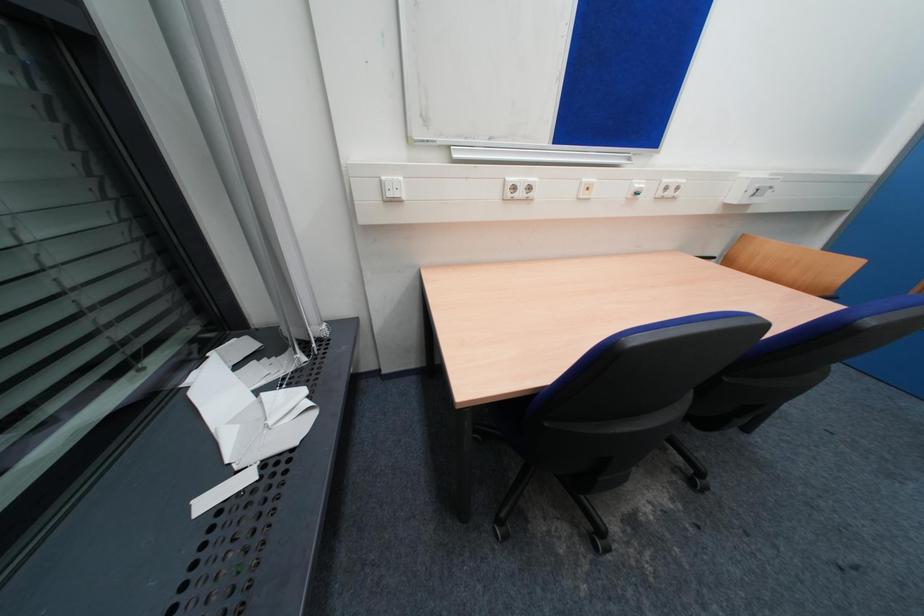
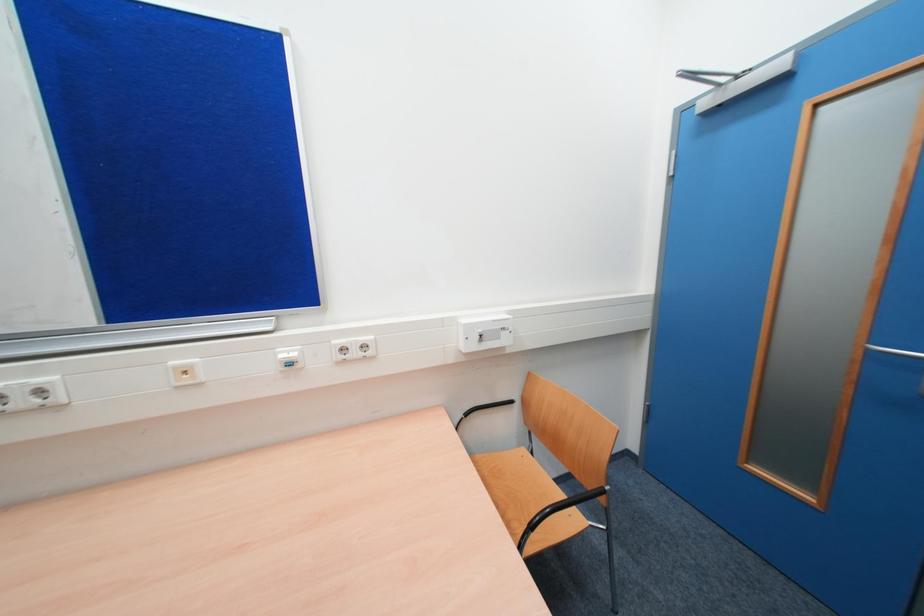
Question: What movement of the cameraman would produce the second image?

Choices:
 (A) Left
 (B) Right
 (C) Forward
 (D) Backward

Answer: (B)